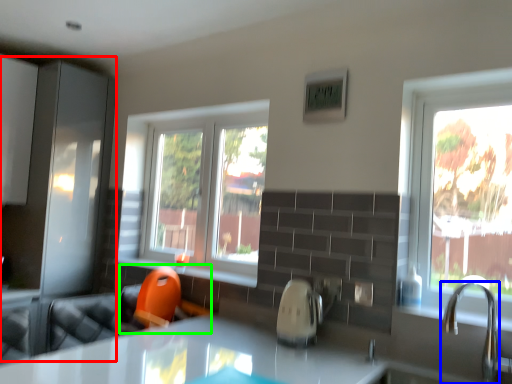
Question: Which object is the closest to the screen door (highlighted by a red box)? Choose among these: tap (highlighted by a blue box) or swivel chair (highlighted by a green box).

Choices:
 (A) tap
 (B) swivel chair

Answer: (B)